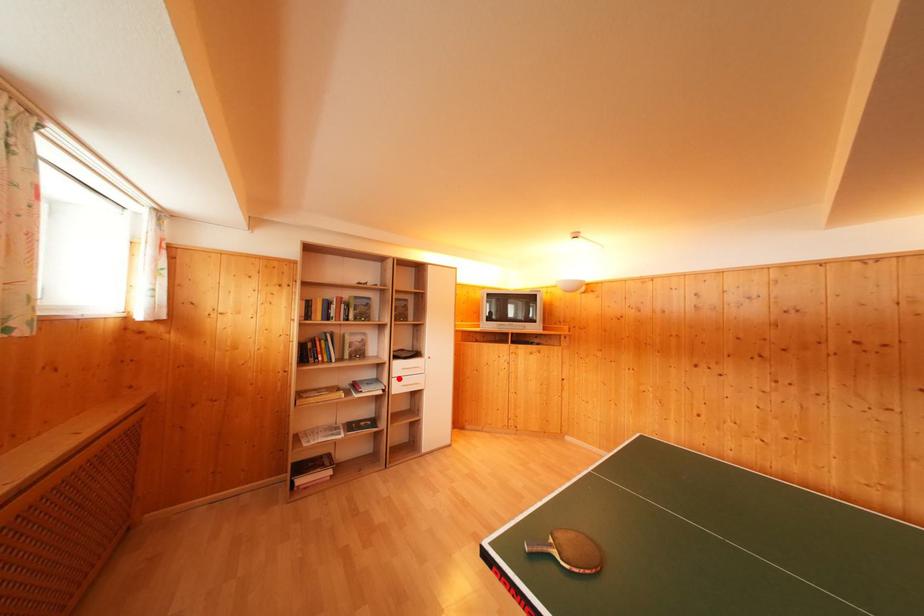
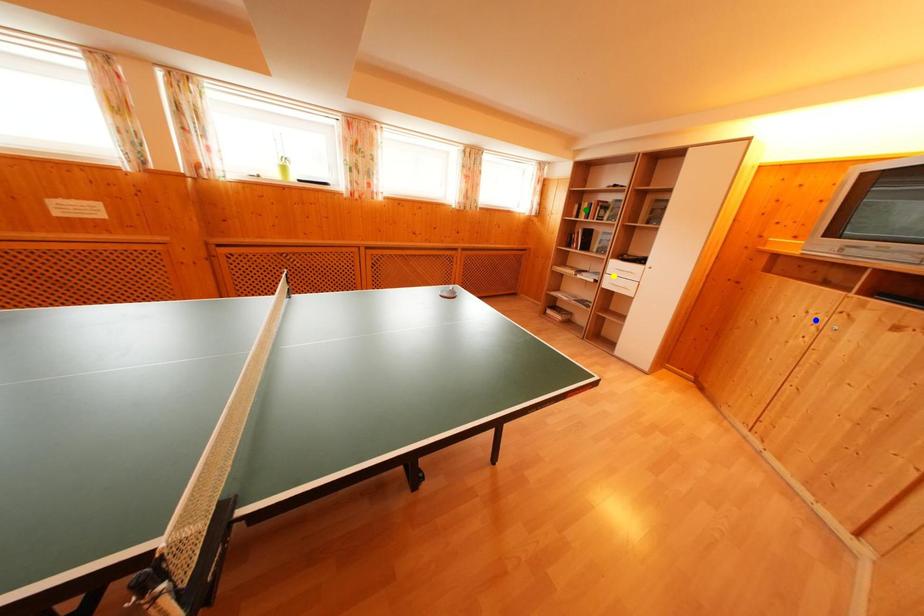
Question: I am providing you with two images of the same scene from different viewpoints. A red point is marked on the first image. You are given multiple points on the second image. Which mark in image 2 goes with the point in image 1?

Choices:
 (A) blue point
 (B) green point
 (C) yellow point

Answer: (C)